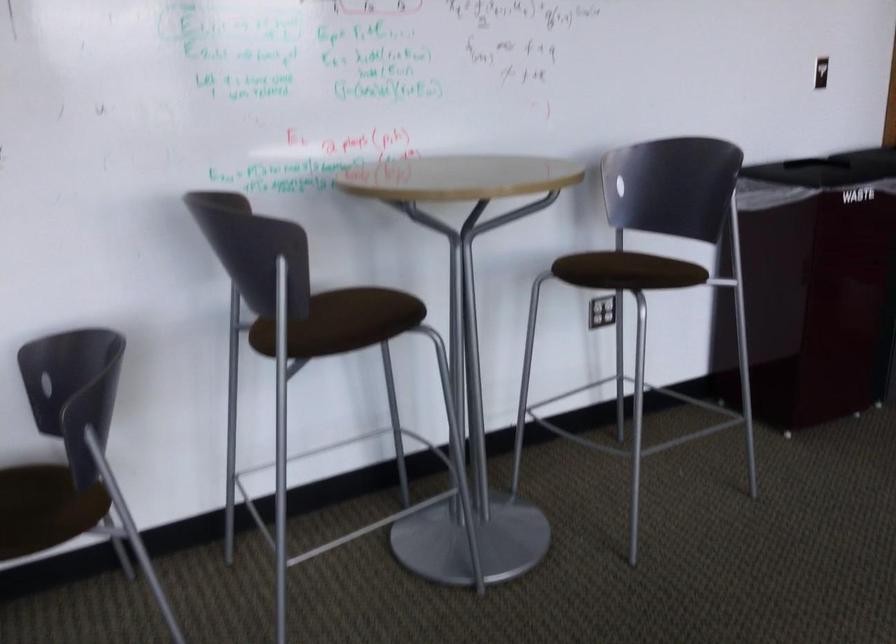
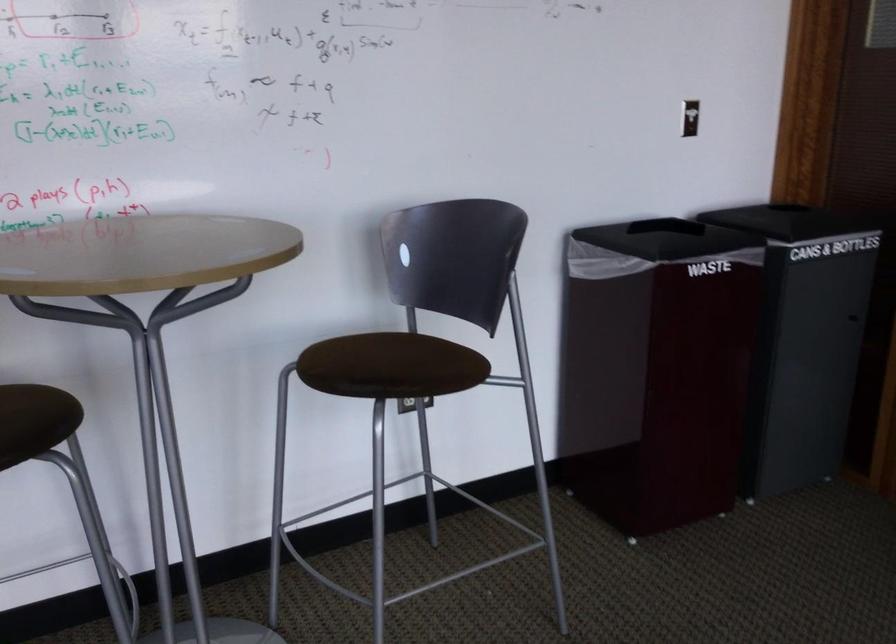
In a continuous first-person perspective shot, in which direction is the camera moving?

The cameraman moved toward right, forward.